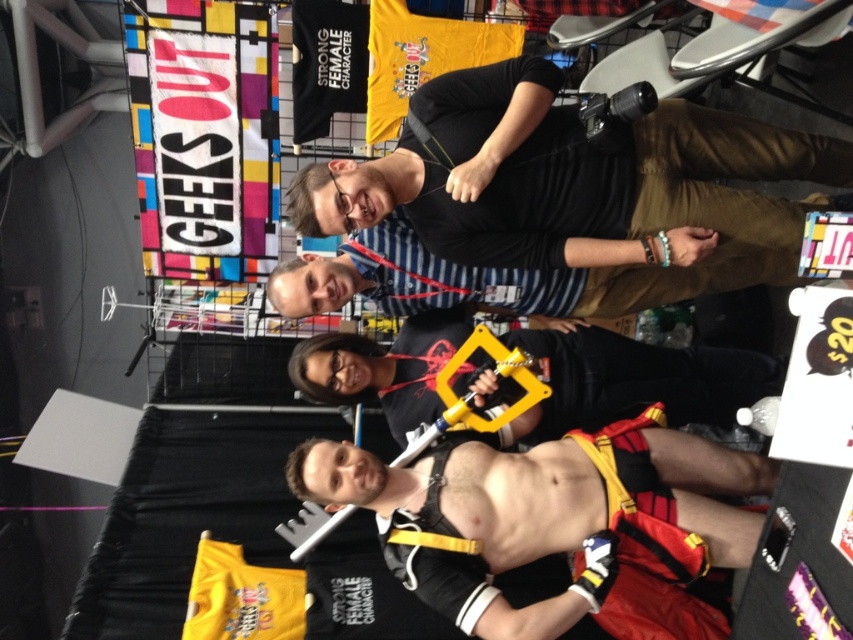
Question: Is black leather harness at center above yellow plastic handcuffs at center?

Choices:
 (A) yes
 (B) no

Answer: (B)

Question: Which of the following is the farthest from the observer?

Choices:
 (A) yellow plastic handcuffs at center
 (B) black leather harness at center

Answer: (A)

Question: Is black leather harness at center wider than yellow plastic handcuffs at center?

Choices:
 (A) yes
 (B) no

Answer: (B)

Question: Considering the relative positions of black leather harness at center and yellow plastic handcuffs at center in the image provided, where is black leather harness at center located with respect to yellow plastic handcuffs at center?

Choices:
 (A) below
 (B) above

Answer: (A)

Question: Which of the following is the closest to the observer?

Choices:
 (A) black leather harness at center
 (B) yellow plastic handcuffs at center

Answer: (A)